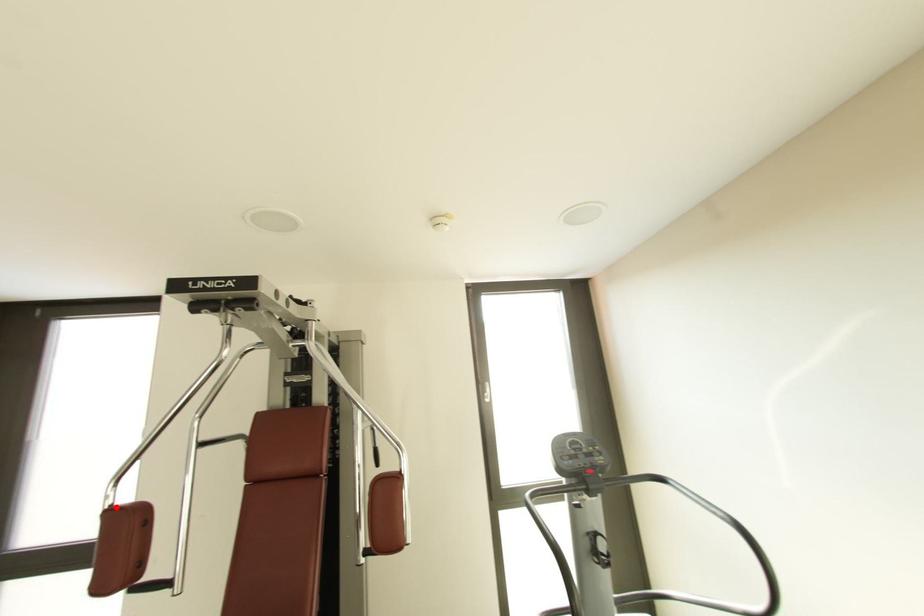
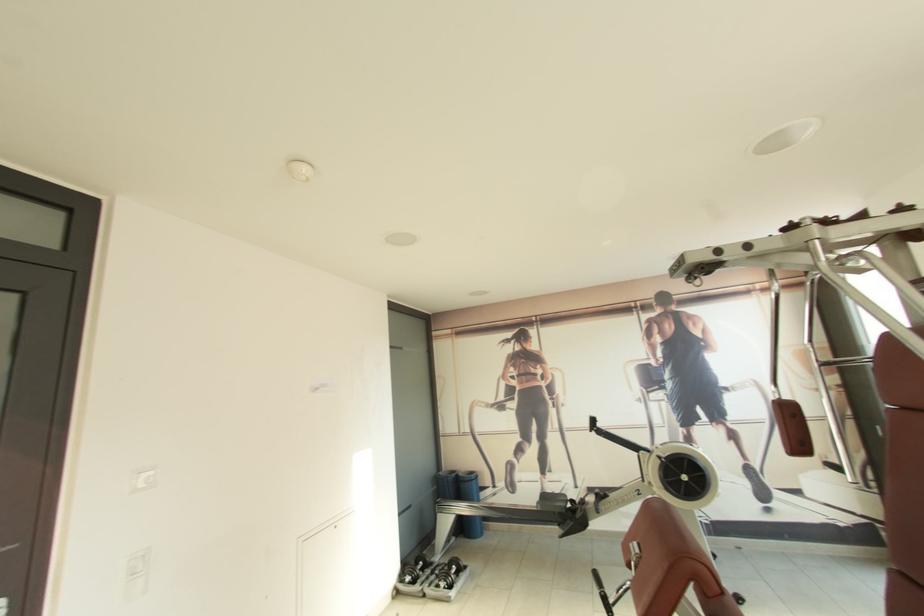
Question: I am providing you with two images of the same scene from different viewpoints. Given a red point in image1, look at the same physical point in image2. Is it:

Choices:
 (A) Closer to the viewpoint
 (B) Farther from the viewpoint

Answer: (B)